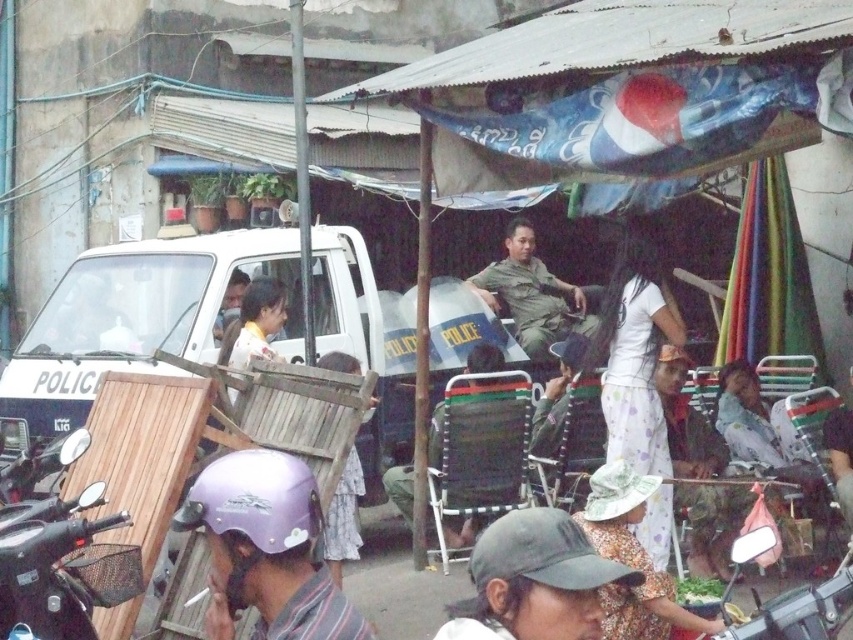
You are a photographer trying to capture a clear shot of the camouflage fabric uniform at center and the light brown wooden chair at center. Since the uniform is wider, will it block the view of the chair in your photo?

The camouflage fabric uniform at center is wider than the light brown wooden chair at center, so it may block the view of the chair depending on the angle and positioning.

You are a photographer trying to capture a wide shot of the scene. You notice the purple matte helmet at lower left and the light brown wooden chair at center. Which object is wider in the image?

The purple matte helmet at lower left is wider than the light brown wooden chair at center.

You are a photographer trying to capture a clear shot of both the purple matte helmet at lower left and the dark gray fabric cap at lower center. Since you want to ensure both are visible in your frame, which object should you focus on first to account for their sizes?

The purple matte helmet at lower left has a greater height compared to the dark gray fabric cap at lower center, so you should focus on the purple matte helmet at lower left first to ensure its full height is captured before adjusting for the smaller dark gray fabric cap at lower center.